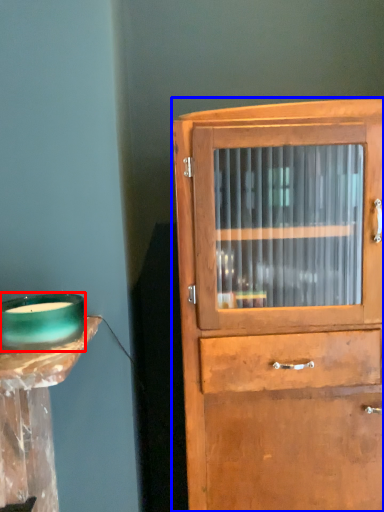
Question: Which of the following is the closest to the observer, candle holder (highlighted by a red box) or cupboard (highlighted by a blue box)?

Choices:
 (A) candle holder
 (B) cupboard

Answer: (A)